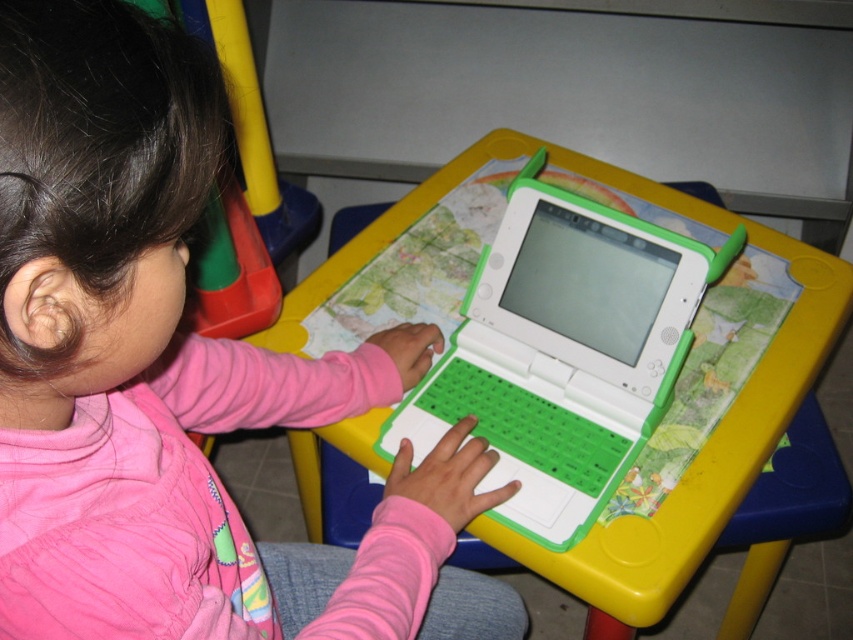
Question: Which point is closer to the camera taking this photo?

Choices:
 (A) (169, 269)
 (B) (477, 403)

Answer: (A)

Question: Among these points, which one is nearest to the camera?

Choices:
 (A) (711, 211)
 (B) (520, 256)
 (C) (109, 588)

Answer: (C)

Question: Which point is farther to the camera?

Choices:
 (A) (59, 232)
 (B) (608, 579)
 (C) (672, 372)

Answer: (C)

Question: Does pink fleece shirt at center appear over green plastic laptop at center?

Choices:
 (A) yes
 (B) no

Answer: (B)

Question: Does pink fleece shirt at center have a lesser width compared to yellow plastic table at center?

Choices:
 (A) no
 (B) yes

Answer: (B)

Question: Observing the image, what is the correct spatial positioning of pink fleece shirt at center in reference to yellow plastic table at center?

Choices:
 (A) above
 (B) below

Answer: (A)